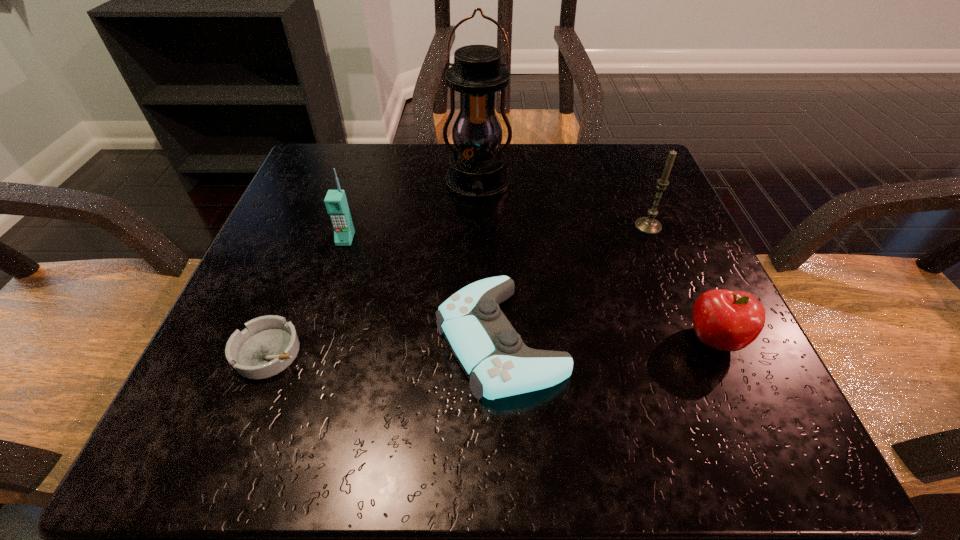
This screenshot has height=540, width=960. I want to click on free spot located on the left of the apple, so click(x=628, y=340).

Where is `free space located on the left of the control`? free space located on the left of the control is located at coordinates (258, 339).

Locate an element on the screen. vacant space located on the right of the shortest object is located at coordinates (463, 352).

This screenshot has width=960, height=540. What are the coordinates of `object positioned at the far edge` in the screenshot? It's located at (477, 169).

Where is `object positioned at the near edge`? This screenshot has height=540, width=960. object positioned at the near edge is located at coordinates (491, 353).

You are a GUI agent. You are given a task and a screenshot of the screen. Output one action in this format:
    pyautogui.click(x=<x>, y=<y>)
    Task: Click on the cellular telephone present at the left edge
    This screenshot has width=960, height=540.
    Given the screenshot: What is the action you would take?
    pyautogui.click(x=336, y=204)

Identify the location of ashtray at the left edge. This screenshot has height=540, width=960. (269, 344).

Locate an element on the screen. This screenshot has height=540, width=960. candle present at the right edge is located at coordinates (649, 225).

In order to click on apple located in the right edge section of the desktop in this screenshot , I will do `click(726, 320)`.

Image resolution: width=960 pixels, height=540 pixels. I want to click on free spot at the far edge of the desktop, so click(x=525, y=166).